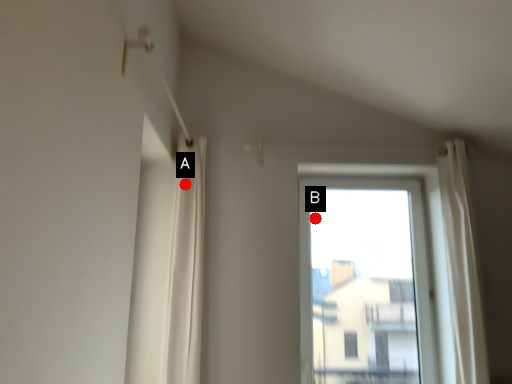
Question: Two points are circled on the image, labeled by A and B beside each circle. Which point is further to the camera?

Choices:
 (A) A is further
 (B) B is further

Answer: (B)